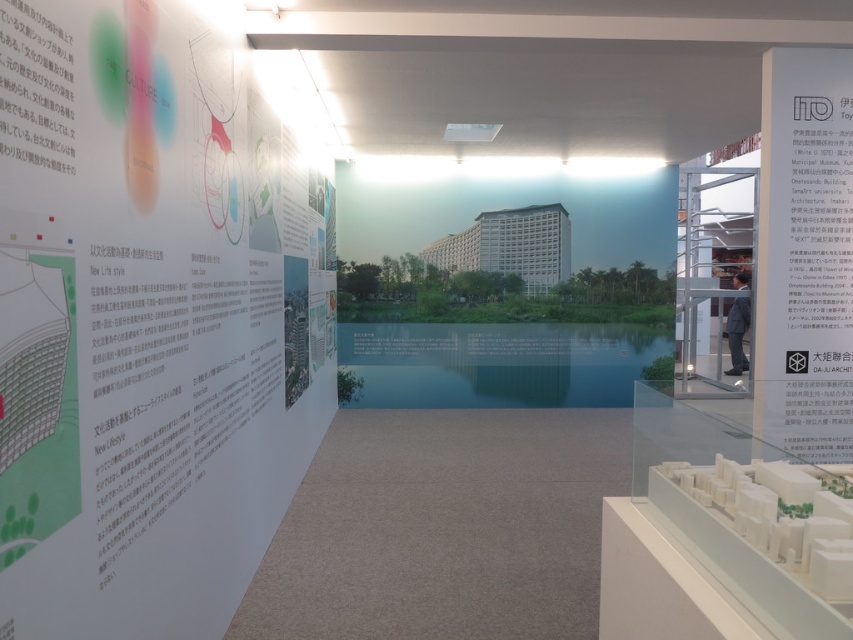
Describe the element at coordinates (148, 321) in the screenshot. The image size is (853, 640). I see `white paper at upper left` at that location.

Does white paper at upper left have a lesser width compared to white matte poster at upper right?

Indeed, white paper at upper left has a lesser width compared to white matte poster at upper right.

This screenshot has height=640, width=853. Identify the location of white paper at upper left. (148, 321).